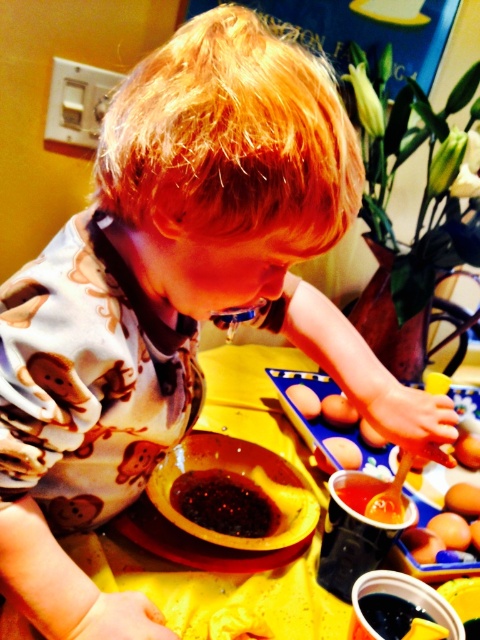
Question: Estimate the real-world distances between objects in this image. Which object is farther from the brown matte egg at center?

Choices:
 (A) smooth orange egg at center
 (B) smooth orange eggs at center
 (C) yellow matte table at center

Answer: (A)

Question: Can you confirm if dark glossy sauce at center is positioned to the right of smooth orange egg at center?

Choices:
 (A) yes
 (B) no

Answer: (B)

Question: Does dark glossy sauce at center have a smaller size compared to smooth orange eggs at center?

Choices:
 (A) no
 (B) yes

Answer: (A)

Question: Is brown matte egg at center wider than smooth orange egg at center?

Choices:
 (A) no
 (B) yes

Answer: (B)

Question: Considering the real-world distances, which object is closest to the smooth orange eggs at center?

Choices:
 (A) dark glossy sauce at center
 (B) yellow matte table at center
 (C) brown matte egg at center
 (D) smooth orange egg at center

Answer: (C)

Question: Estimate the real-world distances between objects in this image. Which object is farther from the yellow matte table at center?

Choices:
 (A) dark glossy sauce at center
 (B) brown matte egg at center
 (C) smooth orange egg at center
 (D) smooth orange eggs at center

Answer: (C)